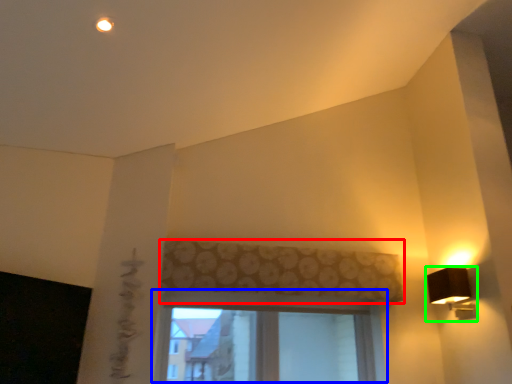
Question: Which is farther away from curtain (highlighted by a red box)? window (highlighted by a blue box) or lamp (highlighted by a green box)?

Choices:
 (A) window
 (B) lamp

Answer: (B)